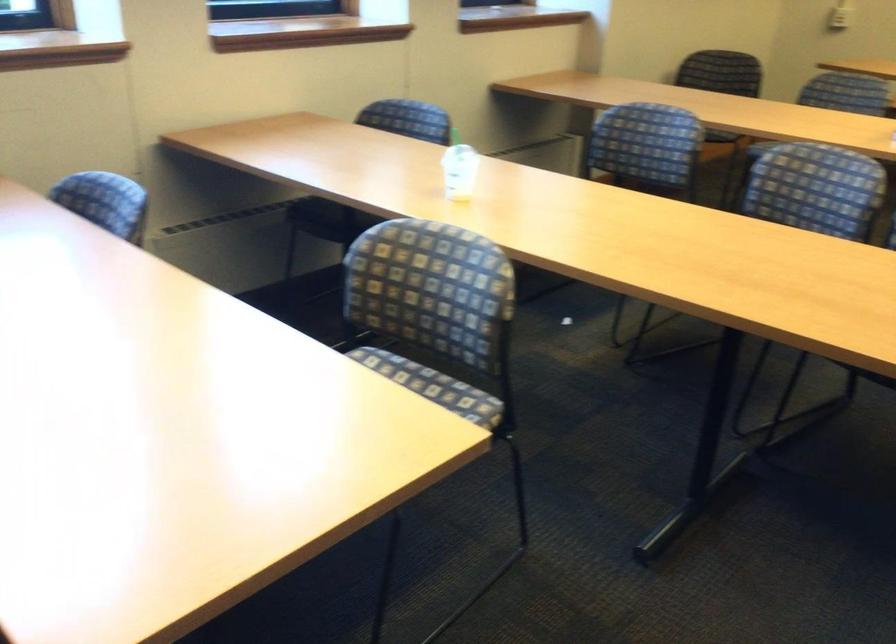
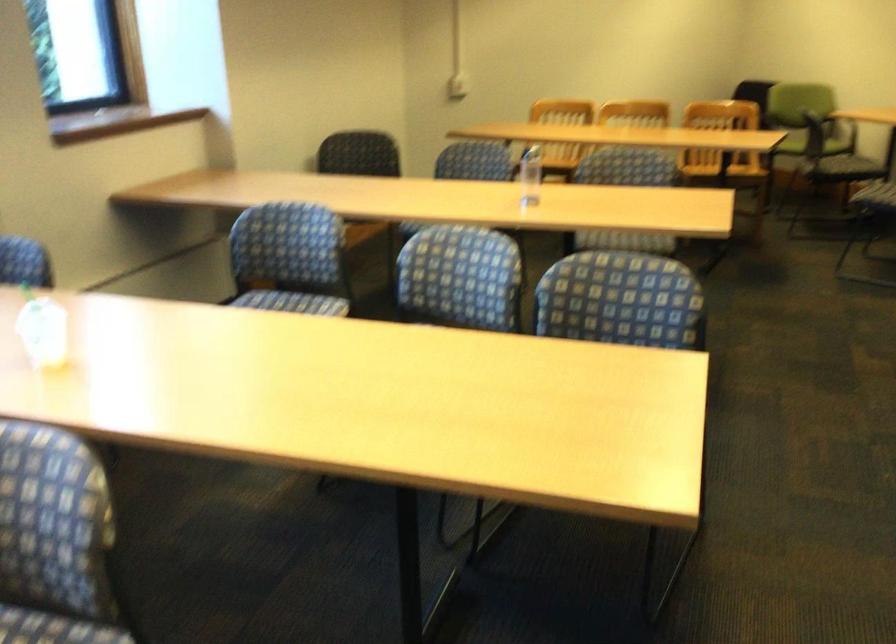
Find the pixel in the second image that matches point 810,185 in the first image.

(460, 277)